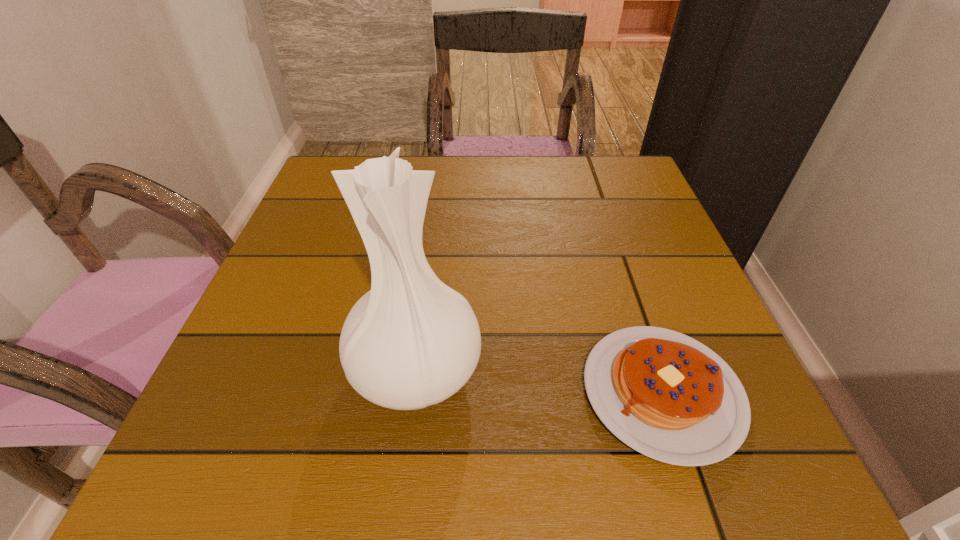
Image resolution: width=960 pixels, height=540 pixels. Find the location of `vacant space at the far edge`. vacant space at the far edge is located at coordinates (492, 171).

Where is `free region at the near edge of the desktop`? free region at the near edge of the desktop is located at coordinates (448, 424).

This screenshot has height=540, width=960. In the image, there is a desktop. Identify the location of vacant region at the right edge. (655, 266).

The image size is (960, 540). I want to click on free space at the far left corner of the desktop, so click(319, 199).

Locate an element on the screen. This screenshot has width=960, height=540. free space that satisfies the following two spatial constraints: 1. on the front side of the left object; 2. on the right side of the shorter object is located at coordinates click(413, 392).